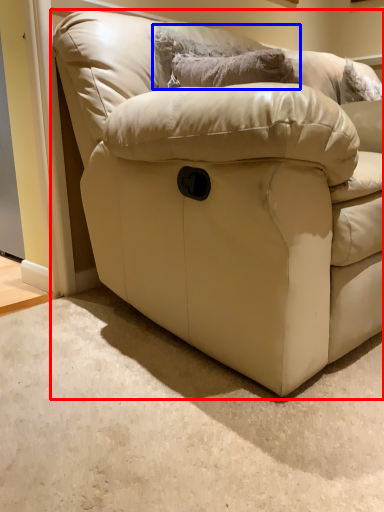
Question: Among these objects, which one is nearest to the camera, studio couch (highlighted by a red box) or pillow (highlighted by a blue box)?

Choices:
 (A) studio couch
 (B) pillow

Answer: (A)